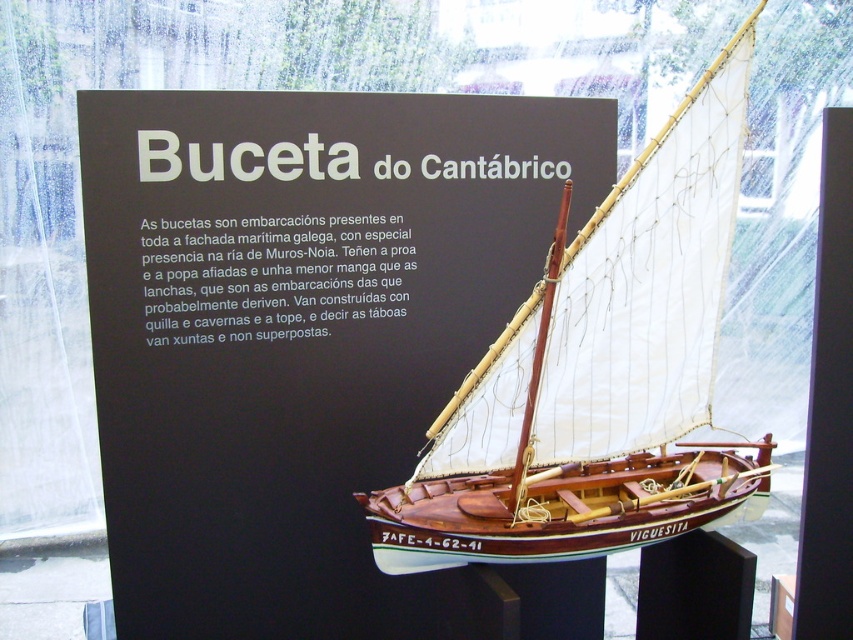
Between matte wood sign at center and wooden sailboat at center, which one appears on the left side from the viewer's perspective?

From the viewer's perspective, matte wood sign at center appears more on the left side.

Between matte wood sign at center and wooden sailboat at center, which one is positioned lower?

wooden sailboat at center is lower down.

Is point (444, 177) more distant than point (631, 349)?

Yes, it is behind point (631, 349).

What are the coordinates of `matte wood sign at center` in the screenshot? It's located at (312, 352).